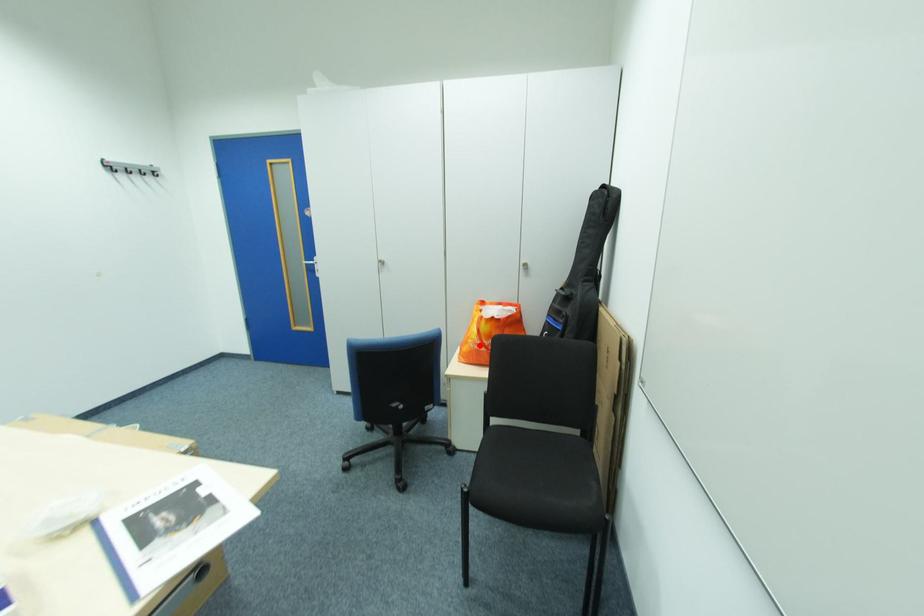
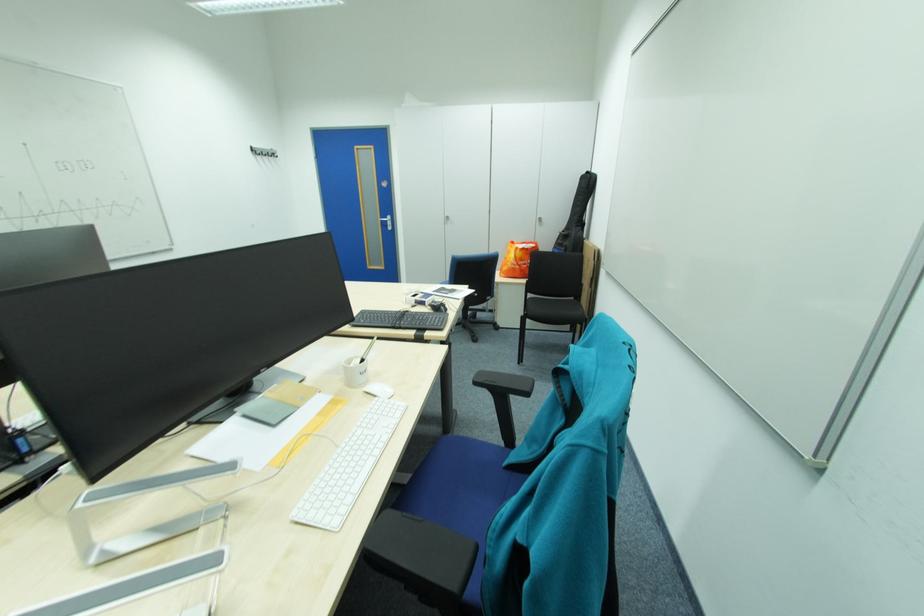
Find the pixel in the second image that matches the highlighted location in the first image.

(517, 265)